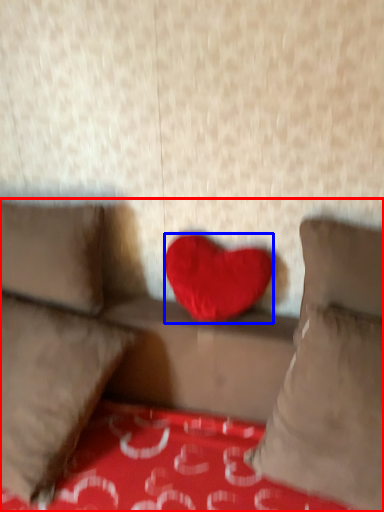
Question: Among these objects, which one is farthest to the camera, studio couch (highlighted by a red box) or heart (highlighted by a blue box)?

Choices:
 (A) studio couch
 (B) heart

Answer: (B)